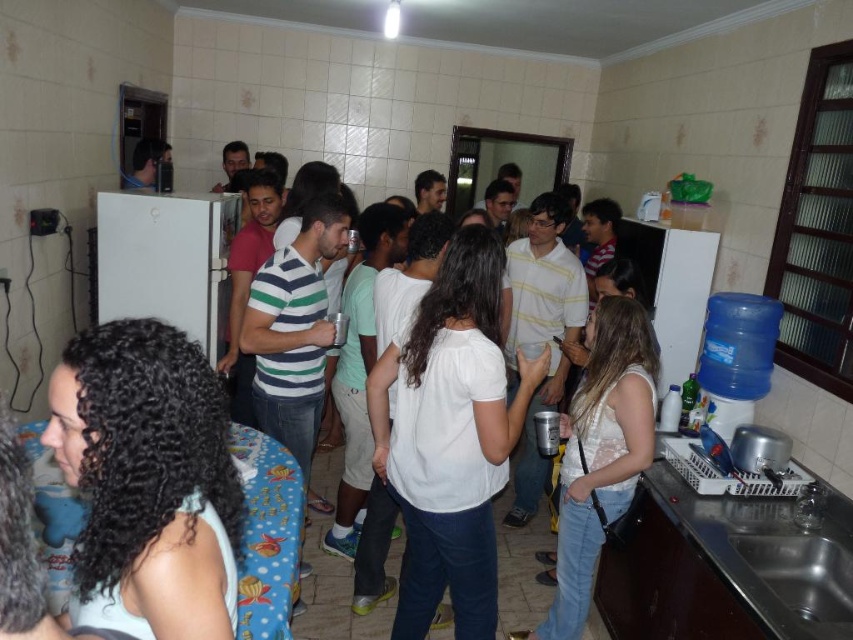
Question: Observing the image, what is the correct spatial positioning of curly hair at center in reference to white lace top at center?

Choices:
 (A) left
 (B) right

Answer: (A)

Question: Is curly hair at center wider than white lace top at center?

Choices:
 (A) yes
 (B) no

Answer: (B)

Question: Estimate the real-world distances between objects in this image. Which object is farther from the white cotton shirt at center?

Choices:
 (A) white lace top at center
 (B) curly hair at center

Answer: (B)

Question: Which object appears farthest from the camera in this image?

Choices:
 (A) white cotton shirt at center
 (B) white lace top at center
 (C) curly hair at center

Answer: (B)

Question: Does curly hair at center have a smaller size compared to white cotton shirt at center?

Choices:
 (A) yes
 (B) no

Answer: (A)

Question: Estimate the real-world distances between objects in this image. Which object is closer to the curly hair at center?

Choices:
 (A) white lace top at center
 (B) white cotton shirt at center

Answer: (B)